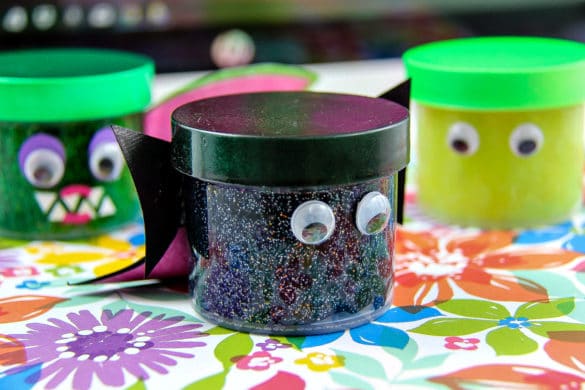
Image resolution: width=585 pixels, height=390 pixels. In order to click on flower tablecloth in this screenshot , I will do `click(103, 344)`, `click(441, 273)`, `click(510, 377)`, `click(514, 320)`, `click(259, 361)`, `click(273, 347)`, `click(322, 357)`, `click(60, 271)`.